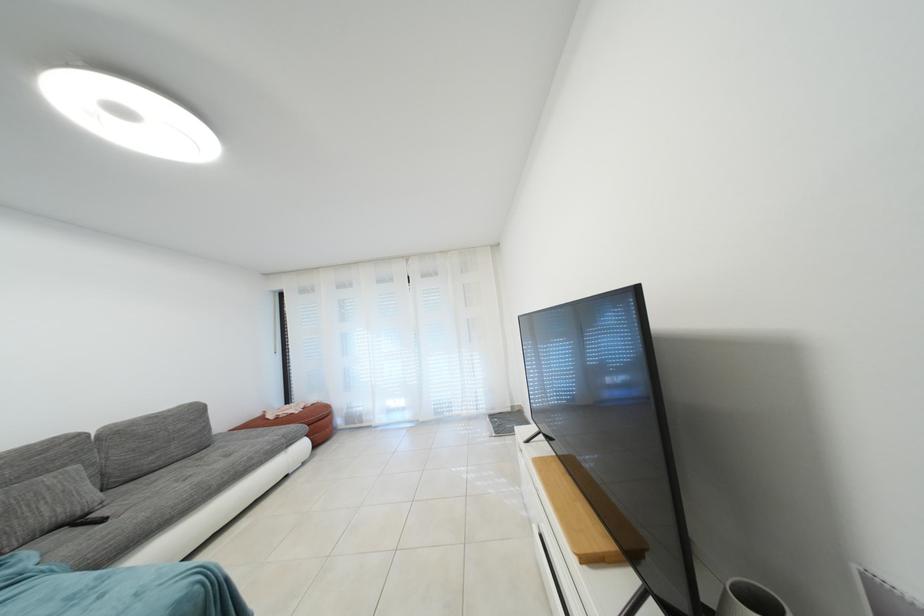
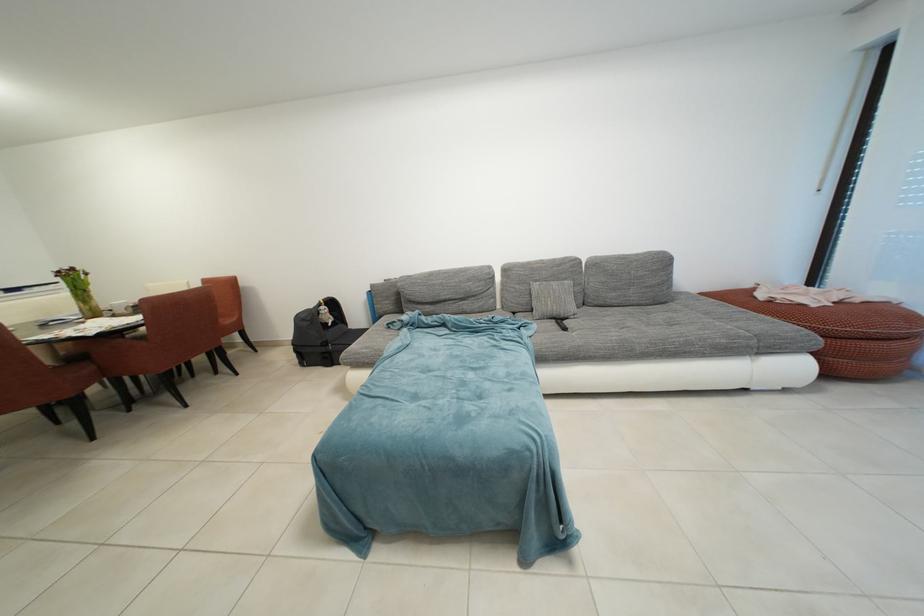
The first image is from the beginning of the video and the second image is from the end. How did the camera likely rotate when shooting the video?

The camera's rotation is toward left-down.